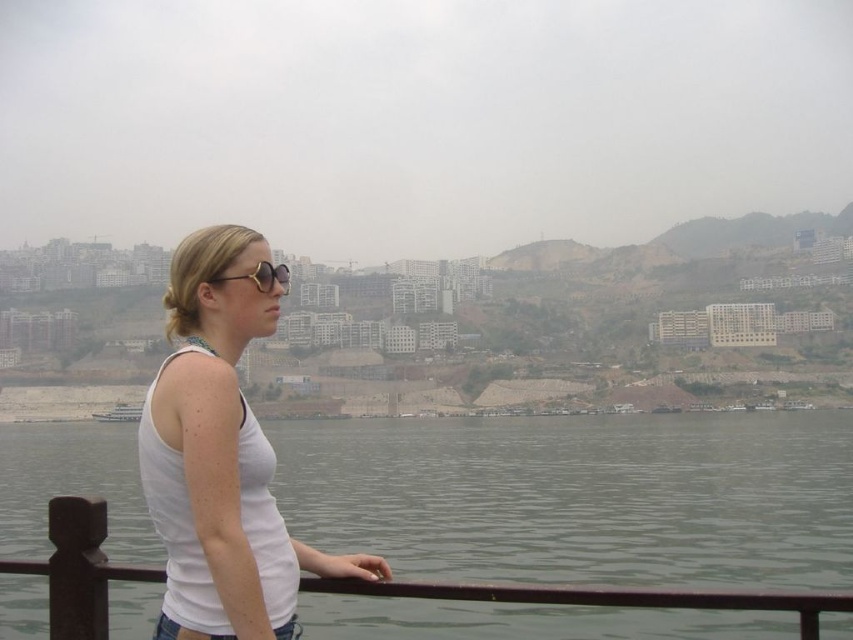
Question: Among these objects, which one is farthest from the camera?

Choices:
 (A) white matte tank top at center
 (B) gold metallic sunglasses at upper center
 (C) white glossy boat at lower center

Answer: (C)

Question: Considering the real-world distances, which object is closest to the clear water at lower left?

Choices:
 (A) white glossy boat at lower center
 (B) white matte tank top at center
 (C) gold metallic sunglasses at upper center

Answer: (A)

Question: Is clear water at lower left below white matte tank top at center?

Choices:
 (A) no
 (B) yes

Answer: (B)

Question: Does gold metallic sunglasses at upper center appear on the right side of white glossy boat at lower center?

Choices:
 (A) no
 (B) yes

Answer: (B)

Question: Based on their relative distances, which object is nearer to the clear water at lower left?

Choices:
 (A) white glossy boat at lower center
 (B) white matte tank top at center
 (C) gold metallic sunglasses at upper center

Answer: (A)

Question: Does clear water at lower left have a larger size compared to gold metallic sunglasses at upper center?

Choices:
 (A) no
 (B) yes

Answer: (B)